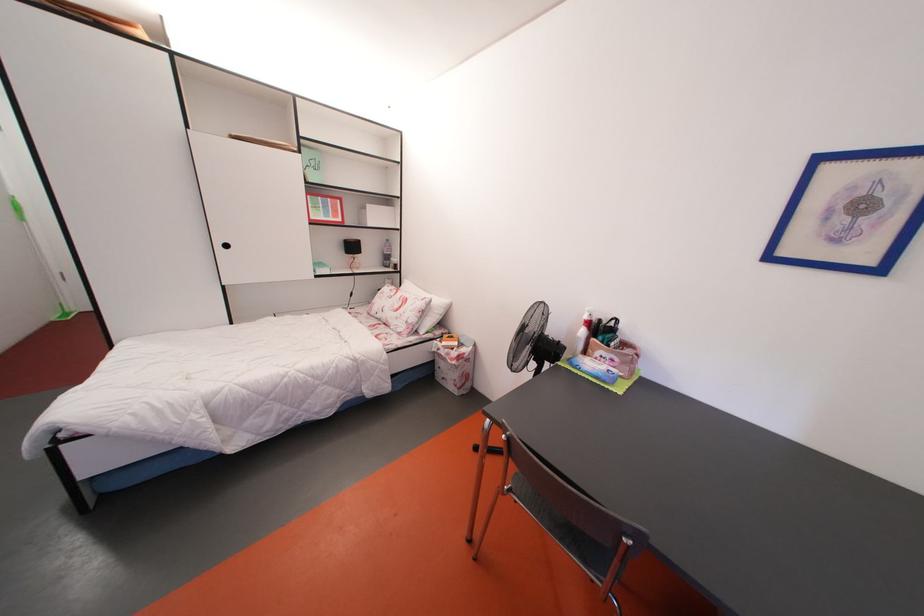
Identify the location of black desk fan. The width and height of the screenshot is (924, 616). (533, 341).